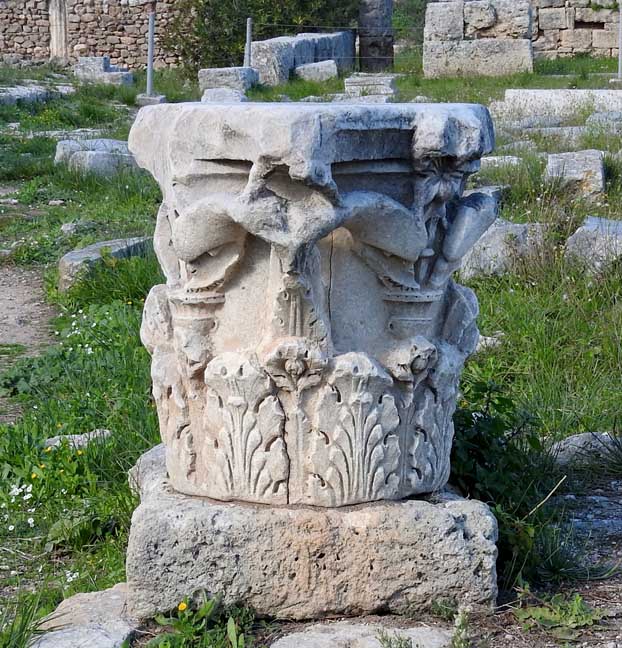
Find the location of a particular element. This screenshot has width=622, height=648. wall is located at coordinates (17, 29), (99, 19), (471, 32), (582, 30).